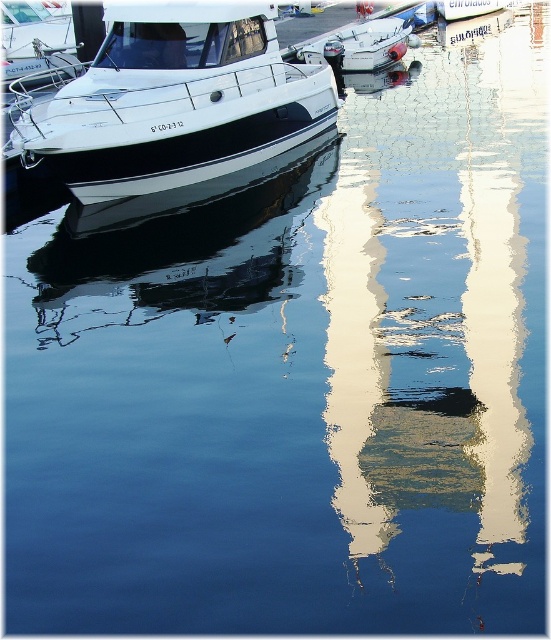
You are a photographer aiming to capture the reflection of both the white glossy boat at upper left and the white glossy boat at center in the water. Which boat will have its reflection closer to the photographer?

The white glossy boat at upper left is positioned under the white glossy boat at center, so its reflection will be closer to the photographer.

Consider the image. You are an observer standing at the edge of the marina. You see the white glossy boat at upper center and the white glossy boat at center. Which boat appears taller from your viewing position?

The white glossy boat at upper center appears taller because it has a greater height compared to the white glossy boat at center.

You are a photographer planning to capture the white glossy boat at upper left and the white glossy boat at upper center in a single frame. Given that your camera can only accommodate objects up to the width of the wider boat, which boat should you position closer to the camera to ensure both fit in the frame?

You should position the white glossy boat at upper left closer to the camera because its width is less than the white glossy boat at upper center. This way, both boats will fit within the camera frame as the narrower boat can be brought closer without exceeding the maximum width limit.